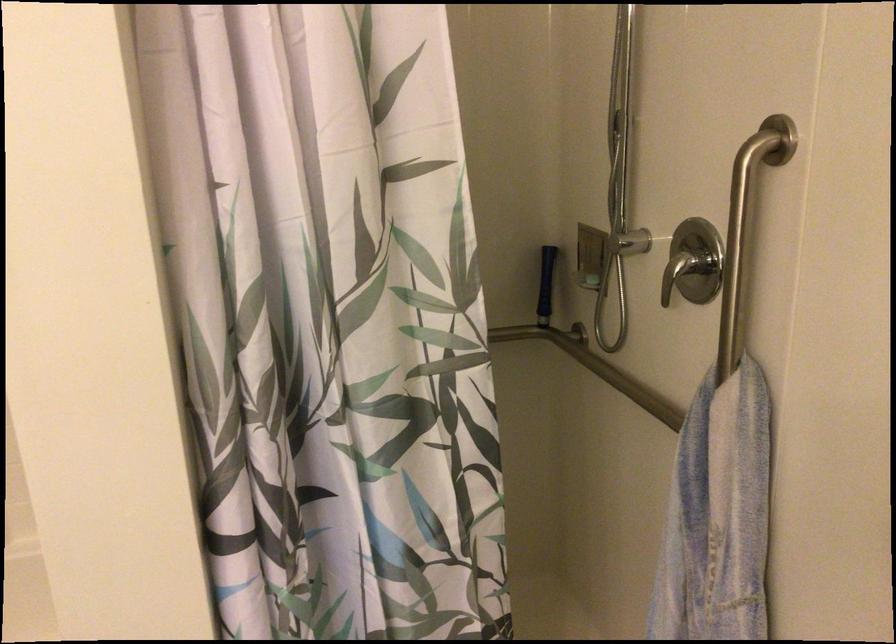
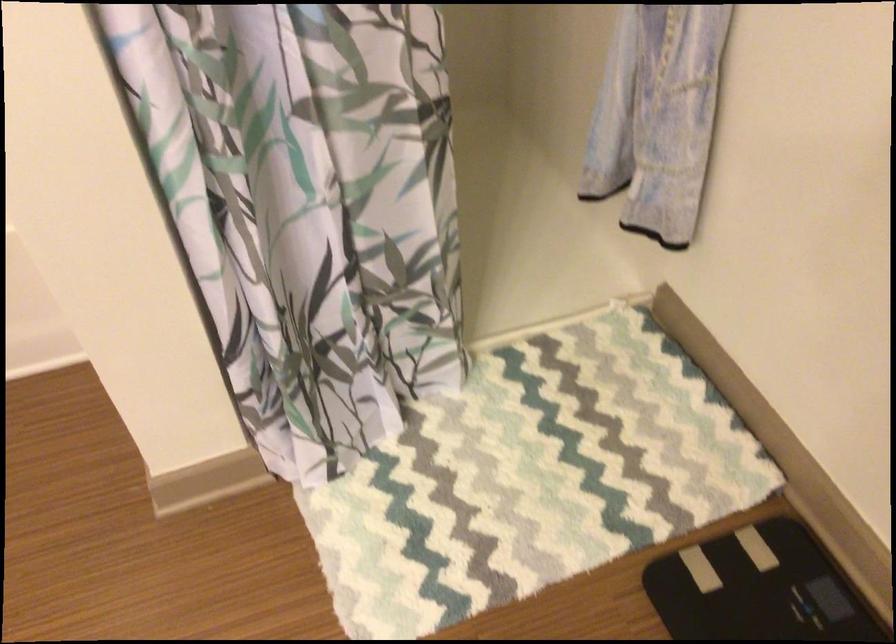
Question: The images are taken continuously from a first-person perspective. In which direction is your viewpoint rotating?

Choices:
 (A) Left
 (B) Right
 (C) Up
 (D) Down

Answer: (D)